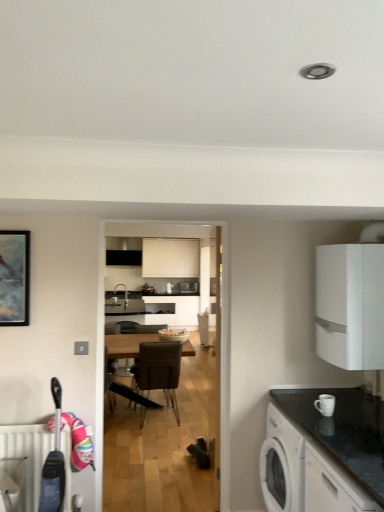
Identify the location of vacant region in front of wooden table at center. (149, 440).